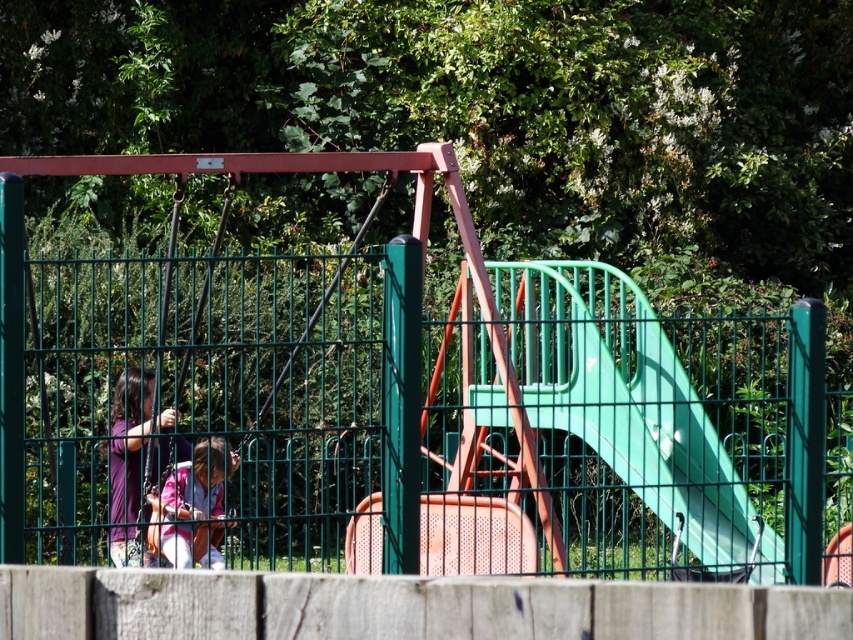
Question: Which is farther from the pink fabric dress at left?

Choices:
 (A) green metal fence at center
 (B) pink fabric at lower left

Answer: (A)

Question: Does green plastic slide at center lie in front of pink fabric at lower left?

Choices:
 (A) yes
 (B) no

Answer: (A)

Question: Is green metal fence at center below pink fabric dress at left?

Choices:
 (A) yes
 (B) no

Answer: (B)

Question: Which point is closer to the camera taking this photo?

Choices:
 (A) (598, 324)
 (B) (202, 560)
 (C) (705, 497)

Answer: (C)

Question: Can you confirm if green metal fence at center is bigger than green plastic slide at center?

Choices:
 (A) yes
 (B) no

Answer: (A)

Question: Which point is closer to the camera?

Choices:
 (A) (143, 438)
 (B) (572, 314)

Answer: (A)